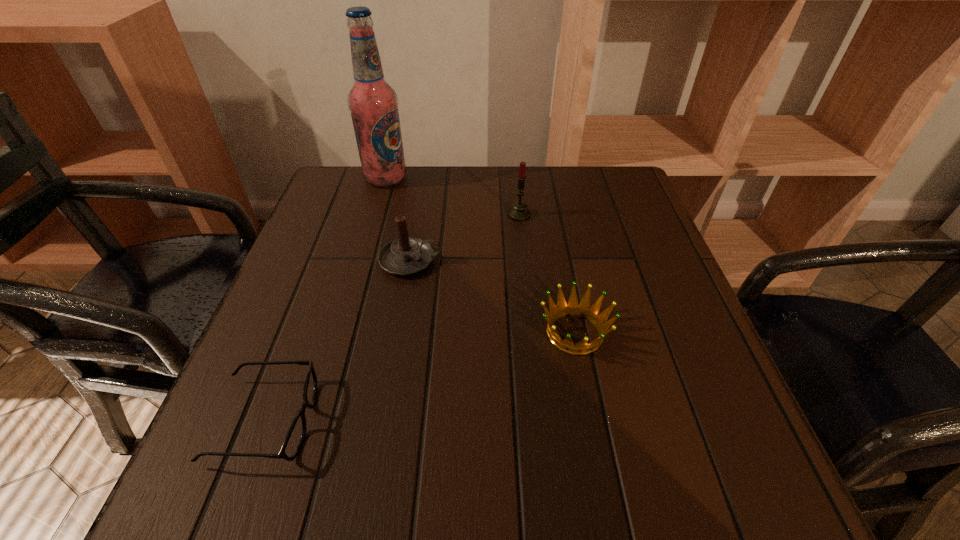
You are a GUI agent. You are given a task and a screenshot of the screen. Output one action in this format:
    pyautogui.click(x=<x>, y=<y>)
    Task: Click on the blank area located 0.230m on the front of the tallest object
    The width and height of the screenshot is (960, 540).
    Given the screenshot: What is the action you would take?
    pyautogui.click(x=366, y=247)

At what (x,y) coordinates should I click in order to perform the action: click on vacant region located on the front of the taller candle. Please return your answer as a coordinate pair (x, y). The image size is (960, 540). Looking at the image, I should click on (530, 320).

I want to click on vacant region located 0.390m on the side of the shorter candle with the handle loop, so click(621, 261).

The width and height of the screenshot is (960, 540). What are the coordinates of `free location located 0.190m on the back of the second nearest object` in the screenshot? It's located at click(557, 244).

This screenshot has height=540, width=960. What are the coordinates of `free space located 0.100m on the front-facing side of the shortest object` in the screenshot? It's located at (377, 421).

At what (x,y) coordinates should I click in order to perform the action: click on alcohol that is at the far edge. Please return your answer as a coordinate pair (x, y). Image resolution: width=960 pixels, height=540 pixels. Looking at the image, I should click on (373, 103).

Locate an element on the screen. The image size is (960, 540). candle that is at the far edge is located at coordinates (518, 212).

At what (x,y) coordinates should I click in order to perform the action: click on object located in the near edge section of the desktop. Please return your answer as a coordinate pair (x, y). This screenshot has height=540, width=960. Looking at the image, I should click on (294, 439).

Locate an element on the screen. The image size is (960, 540). alcohol present at the left edge is located at coordinates (373, 103).

Locate an element on the screen. The height and width of the screenshot is (540, 960). spectacles situated at the left edge is located at coordinates (294, 439).